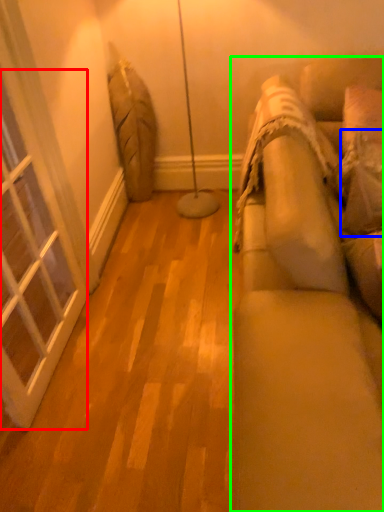
Question: Estimate the real-world distances between objects in this image. Which object is farther from window (highlighted by a red box), pillow (highlighted by a blue box) or studio couch (highlighted by a green box)?

Choices:
 (A) pillow
 (B) studio couch

Answer: (A)